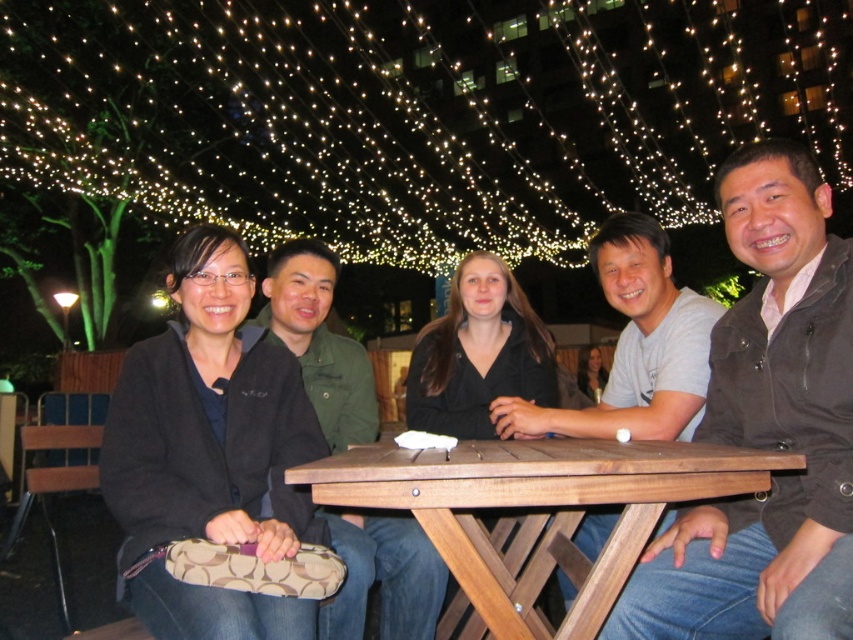
Question: Among these objects, which one is farthest from the camera?

Choices:
 (A) black fuzzy sweater at left
 (B) brown leather jacket at right
 (C) wooden table at center

Answer: (A)

Question: Is brown leather jacket at right to the left of wooden table at center from the viewer's perspective?

Choices:
 (A) no
 (B) yes

Answer: (A)

Question: Among these points, which one is nearest to the camera?

Choices:
 (A) (838, 396)
 (B) (454, 513)
 (C) (207, 346)

Answer: (A)

Question: Which object is the farthest from the brown leather jacket at right?

Choices:
 (A) black fuzzy sweater at left
 (B) wooden table at center

Answer: (A)

Question: Is brown leather jacket at right positioned at the back of wooden table at center?

Choices:
 (A) no
 (B) yes

Answer: (A)

Question: In this image, where is brown leather jacket at right located relative to black fuzzy sweater at left?

Choices:
 (A) right
 (B) left

Answer: (A)